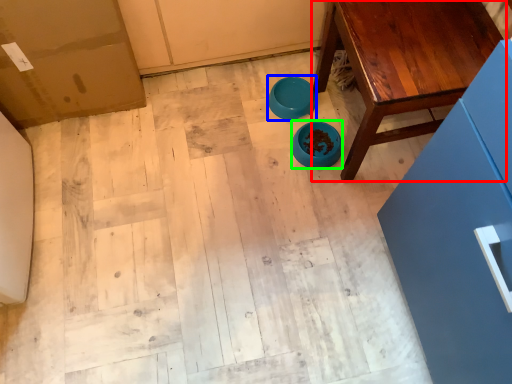
Question: Which is farther away from table (highlighted by a red box)? bowl (highlighted by a blue box) or bowl (highlighted by a green box)?

Choices:
 (A) bowl
 (B) bowl

Answer: (A)